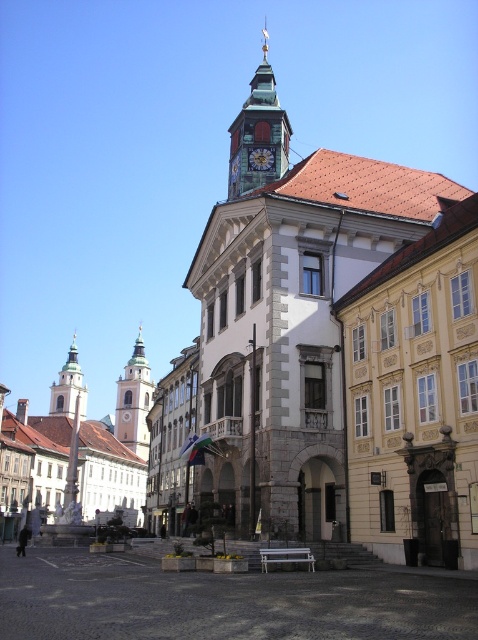
You are a tourist standing in front of the historic building and want to take a photo that includes both the green copper clock tower at upper center and the gold metallic clock at center. Which object will appear larger in the photo?

The green copper clock tower at upper center will appear larger in the photo because it is taller than the gold metallic clock at center.

You are a city planner assessing the architectural features of the historic district. You need to determine if the green copper clock tower at upper center can accommodate a new decorative element on its side without obstructing the gold metallic clock at center. Based on their relative widths, is this feasible?

The green copper clock tower at upper center might be wider than the gold metallic clock at center, so there is a possibility that adding a decorative element on its side could be feasible without obstructing the gold metallic clock at center, provided the width difference allows sufficient space.

You are a tourist standing in front of the historic building and want to take a photo that includes both the green copper clock tower at upper center and the smooth white tower at center. Based on their heights, which tower should you focus on to ensure both are fully visible in the frame?

The green copper clock tower at upper center is much taller than the smooth white tower at center, so focusing on the taller green copper clock tower at upper center will ensure both are fully visible in the frame.